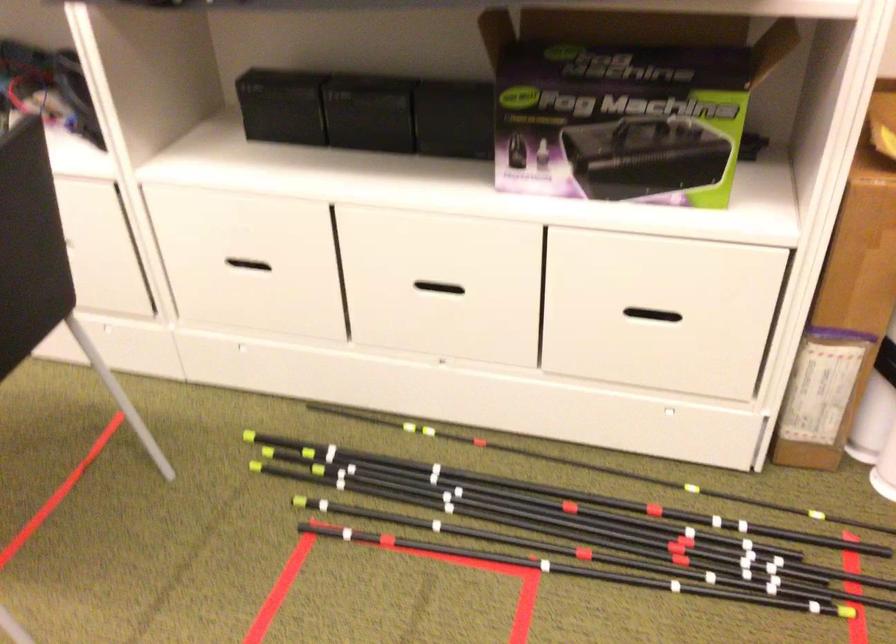
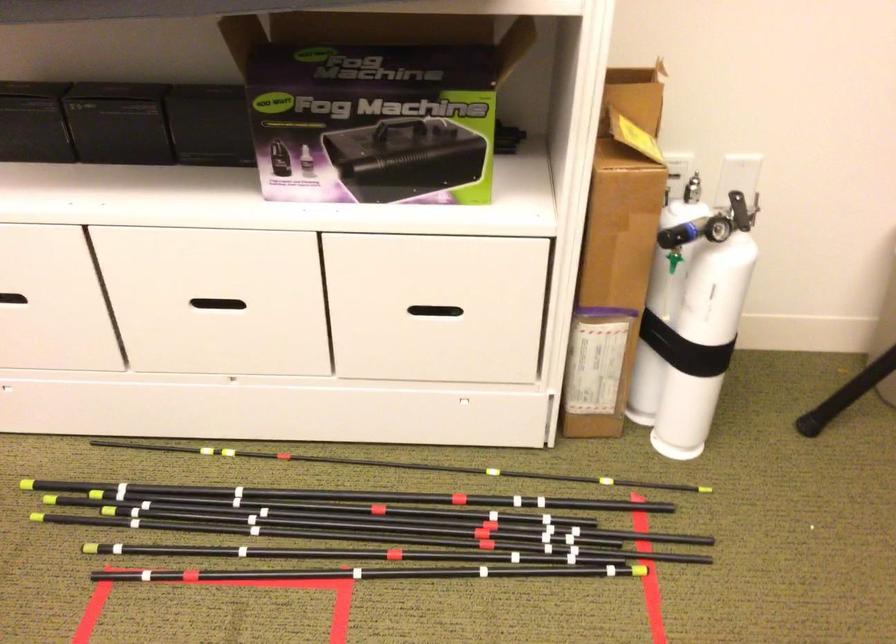
Where in the second image is the point corresponding to (444,286) from the first image?

(225, 299)